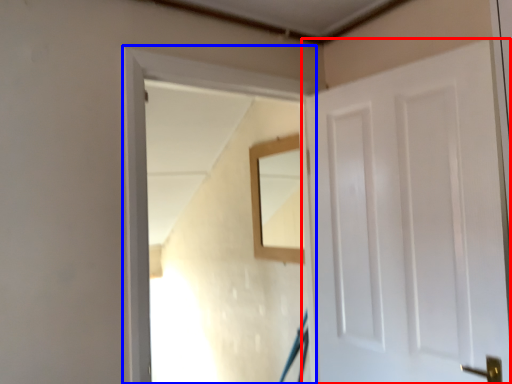
Question: Among these objects, which one is farthest to the camera, door (highlighted by a red box) or window frame (highlighted by a blue box)?

Choices:
 (A) door
 (B) window frame

Answer: (B)